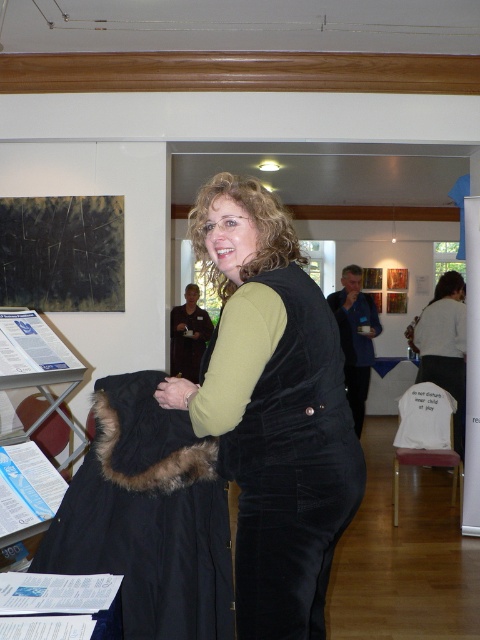
You are an art gallery attendant and need to place a new painting that requires a specific hanging height. The painting must be hung at the same height as the velvet black vest at center. What is the vertical coordinate for hanging the painting?

The velvet black vest at center is located at point 0.569 vertically, so the painting should be hung at the vertical coordinate 0.569 to match its position.

You are a photographer standing in the center of the gallery. You want to take a photo of the black furry coat at lower left without including the woman in the frame. Is the coat positioned in a way that allows this? Please explain your reasoning.

The black furry coat at lower left is located at point (x=147, y=516), which is to the lower left of the image. Since the woman is in the foreground and centered, positioning the camera towards the lower left corner should allow capturing the coat without including her in the frame.

You are an art curator who needs to place a new sculpture that is 2 meters wide between the velvet black vest at center and the dark textured canvas at upper left. Can the sculpture fit between them without overlapping either object?

The velvet black vest at center and dark textured canvas at upper left are 2.38 meters apart from each other. Since the sculpture is 2 meters wide, it can fit between them as the distance between the two objects is greater than the sculpture width.